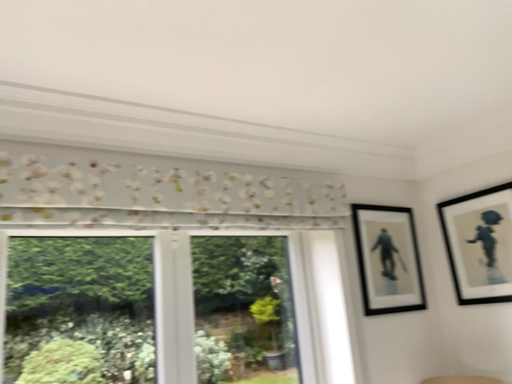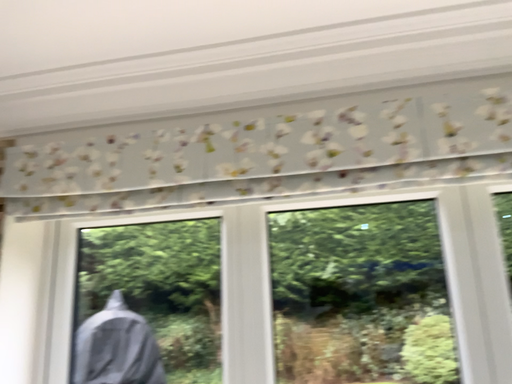
Question: Which way did the camera rotate in the video?

Choices:
 (A) rotated left
 (B) rotated right

Answer: (A)